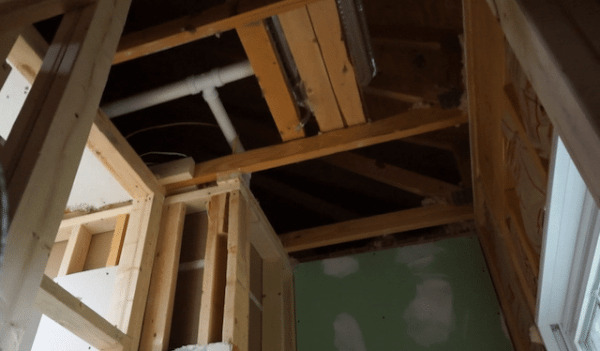
Where is `electrical wires`? The width and height of the screenshot is (600, 351). electrical wires is located at coordinates (184, 121), (171, 151).